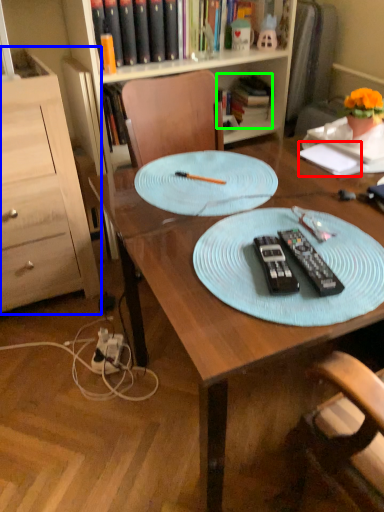
Question: Which object is the farthest from notepad (highlighted by a red box)? Choose among these: cabinetry (highlighted by a blue box) or book (highlighted by a green box).

Choices:
 (A) cabinetry
 (B) book

Answer: (A)